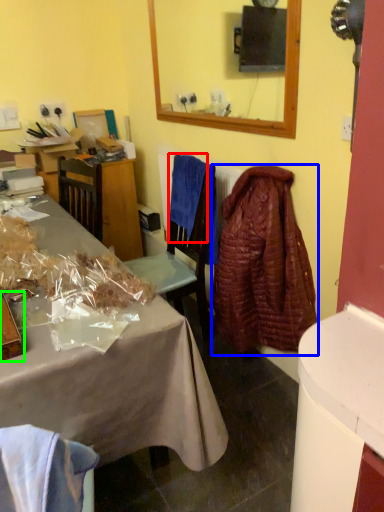
Question: Which is farther away from cloth (highlighted by a red box)? robe (highlighted by a blue box) or box (highlighted by a green box)?

Choices:
 (A) robe
 (B) box

Answer: (B)